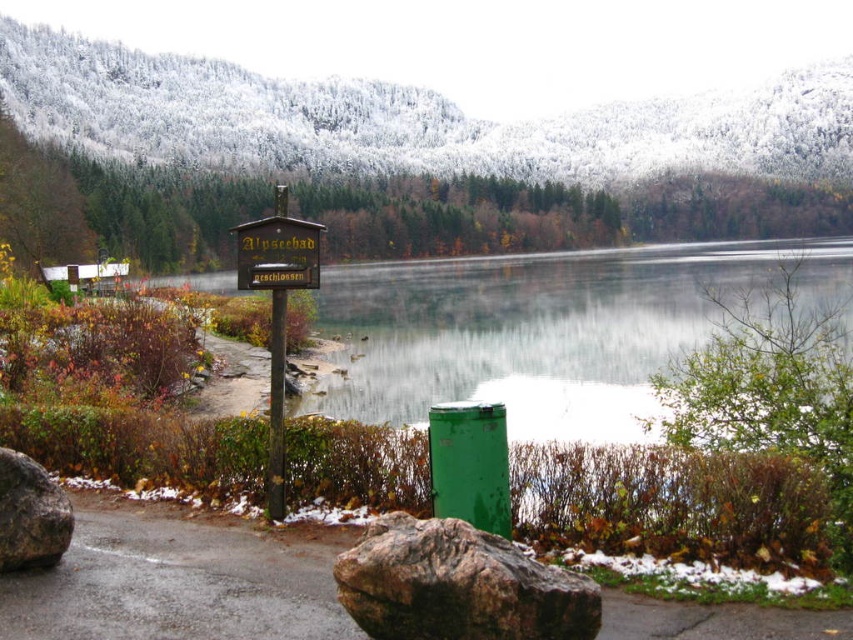
Does green metallic water at center appear over rough gray rock at lower left?

Yes.

Can you confirm if green metallic water at center is taller than rough gray rock at lower left?

Indeed, green metallic water at center has a greater height compared to rough gray rock at lower left.

Is point (453, 342) positioned in front of point (15, 556)?

No, (453, 342) is further to viewer.

Where is `green metallic water at center`? Image resolution: width=853 pixels, height=640 pixels. green metallic water at center is located at coordinates (550, 330).

How far apart are snow-covered forest at upper center and brown rough rock at lower center?

A distance of 324.52 meters exists between snow-covered forest at upper center and brown rough rock at lower center.

Measure the distance from snow-covered forest at upper center to brown rough rock at lower center.

A distance of 1064.71 feet exists between snow-covered forest at upper center and brown rough rock at lower center.

Identify the location of snow-covered forest at upper center. (413, 118).

Is point (531, 634) positioned after point (288, 273)?

No, (531, 634) is in front of (288, 273).

Is brown rough rock at lower center closer to camera compared to wooden sign at center?

Yes, brown rough rock at lower center is closer to the viewer.

Between point (341, 556) and point (310, 240), which one is positioned behind?

The point (310, 240) is more distant.

The image size is (853, 640). In order to click on brown rough rock at lower center in this screenshot , I will do `click(457, 586)`.